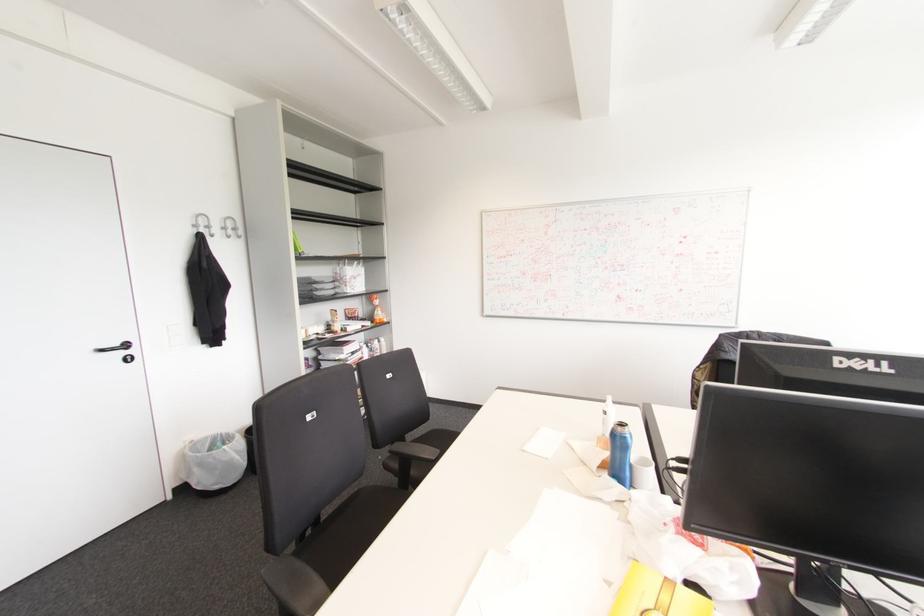
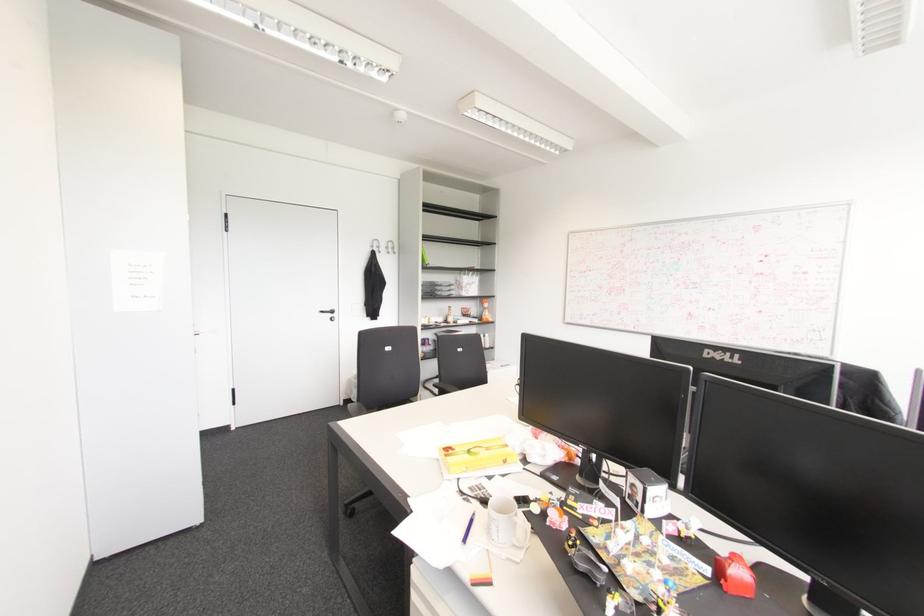
In the second image, find the point that corresponds to (375,301) in the first image.

(485, 305)